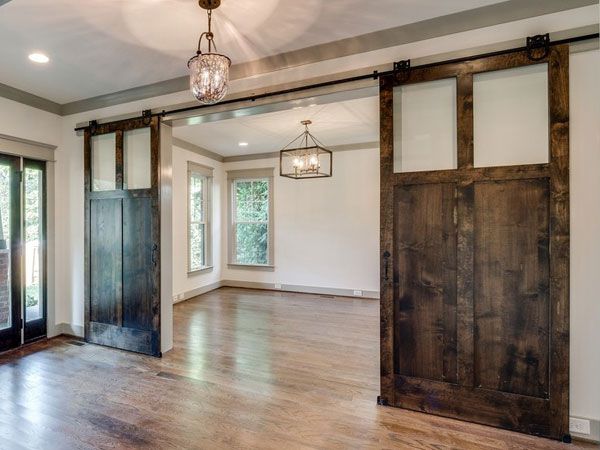
Locate an element on the screen. lights in the celling is located at coordinates (38, 56), (241, 143).